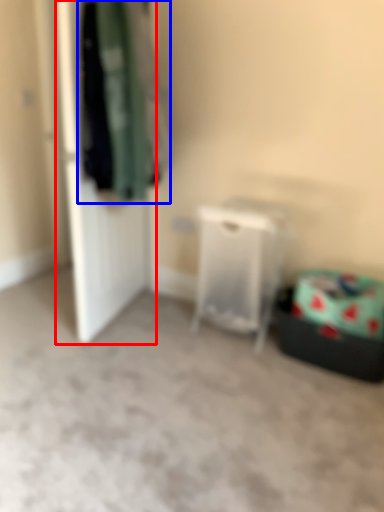
Question: Among these objects, which one is farthest to the camera, door (highlighted by a red box) or clothing (highlighted by a blue box)?

Choices:
 (A) door
 (B) clothing

Answer: (A)